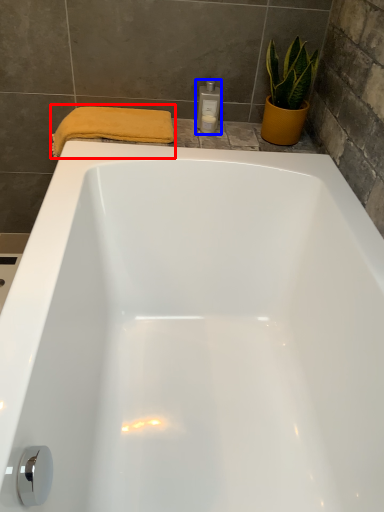
Question: Which object is further to the camera taking this photo, bath towel (highlighted by a red box) or toiletry (highlighted by a blue box)?

Choices:
 (A) bath towel
 (B) toiletry

Answer: (B)